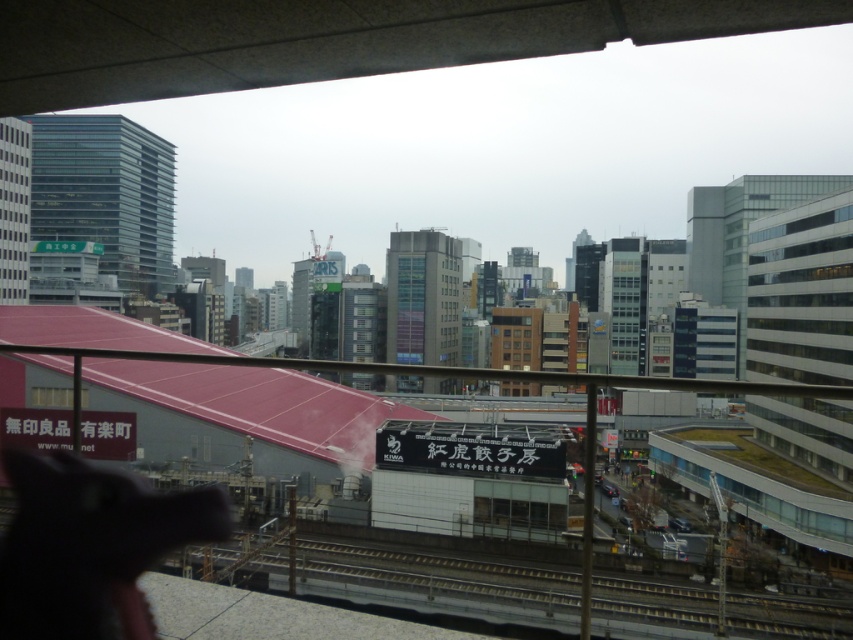
Question: Which point is farther to the camera?

Choices:
 (A) metallic gray train track at lower center
 (B) concrete overpass at upper center

Answer: (A)

Question: Does concrete overpass at upper center have a lesser width compared to metallic gray train track at lower center?

Choices:
 (A) yes
 (B) no

Answer: (A)

Question: Which of the following is the farthest from the observer?

Choices:
 (A) (215, 573)
 (B) (776, 26)

Answer: (A)

Question: Is the position of concrete overpass at upper center more distant than that of metallic gray train track at lower center?

Choices:
 (A) yes
 (B) no

Answer: (B)

Question: Is concrete overpass at upper center to the left of metallic gray train track at lower center from the viewer's perspective?

Choices:
 (A) yes
 (B) no

Answer: (A)